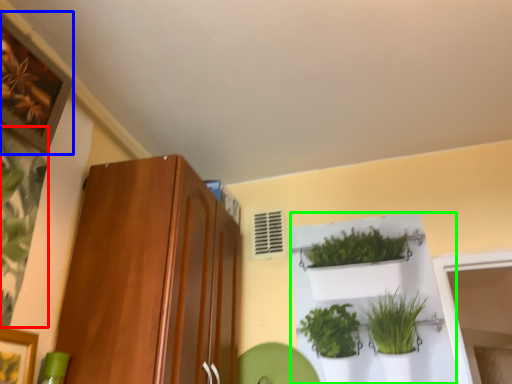
Question: Based on their relative distances, which object is nearer to plant (highlighted by a red box)? Choose from picture frame (highlighted by a blue box) and shelf (highlighted by a green box).

Choices:
 (A) picture frame
 (B) shelf

Answer: (A)